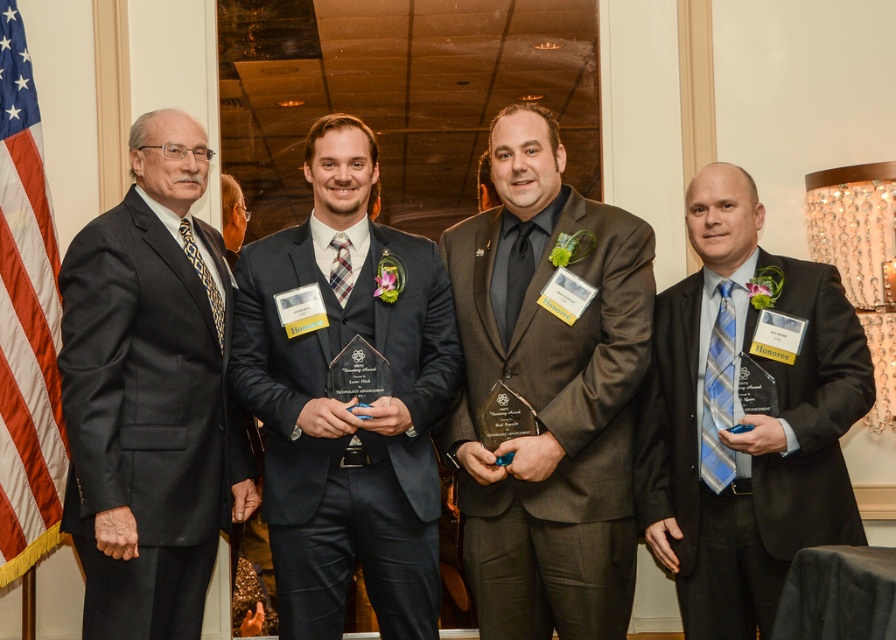
Question: Can you confirm if matte black suit at center is wider than plaid silk tie at center?

Choices:
 (A) no
 (B) yes

Answer: (B)

Question: Does brown textured suit at center appear under black pinstripe suit at left?

Choices:
 (A) no
 (B) yes

Answer: (A)

Question: Estimate the real-world distances between objects in this image. Which object is farther from the brown textured suit at center?

Choices:
 (A) plaid silk tie at center
 (B) matte black suit at right
 (C) black pinstripe suit at left
 (D) leopard print tie at left

Answer: (D)

Question: Which is nearer to the blue striped tie at right?

Choices:
 (A) black satin tie at center
 (B) matte black suit at right
 (C) matte black suit at center
 (D) black pinstripe suit at left

Answer: (B)

Question: Is leopard print tie at left below plaid silk tie at center?

Choices:
 (A) no
 (B) yes

Answer: (B)

Question: Estimate the real-world distances between objects in this image. Which object is farther from the matte black suit at right?

Choices:
 (A) matte black suit at center
 (B) red-white striped flag at left

Answer: (B)